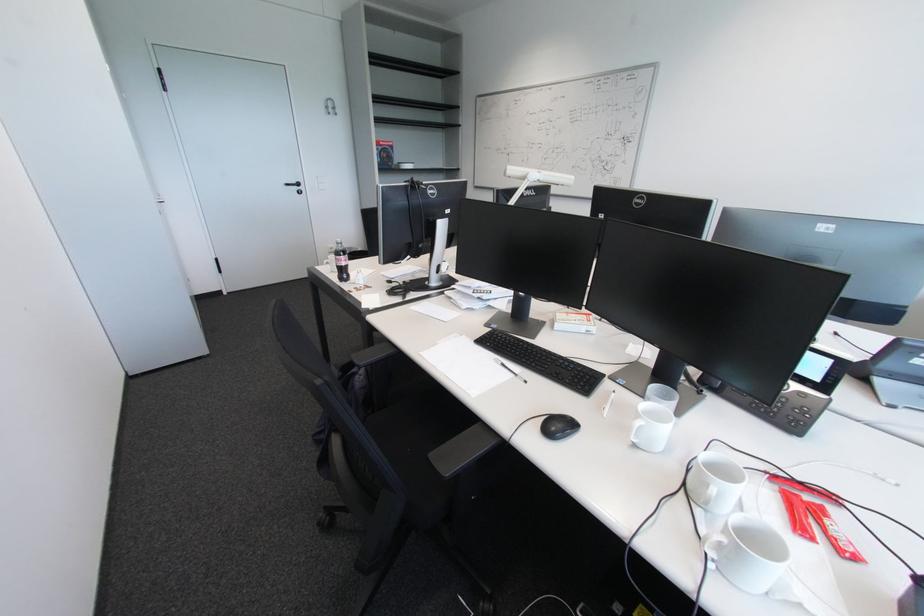
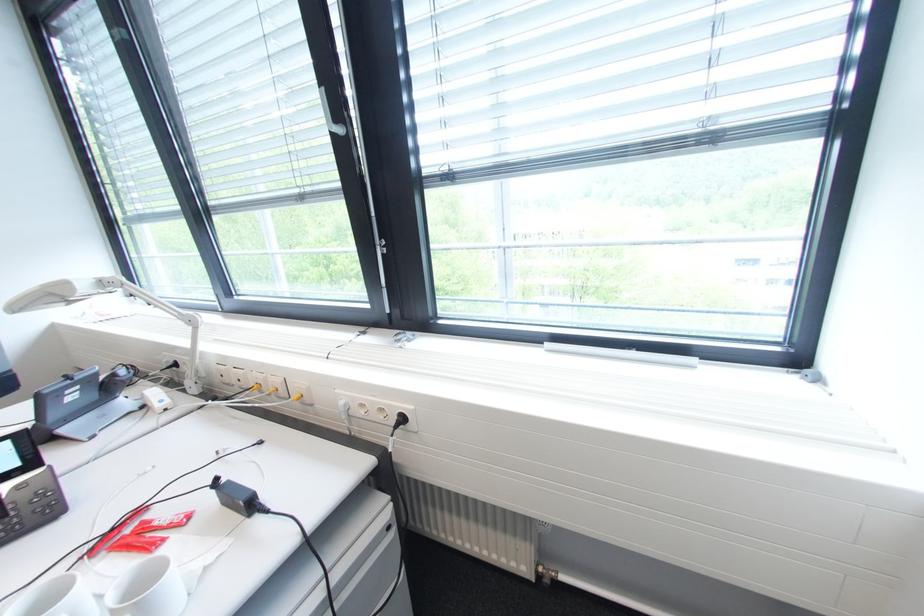
Where in the second image is the point corresponding to point (731, 474) from the first image?

(55, 601)